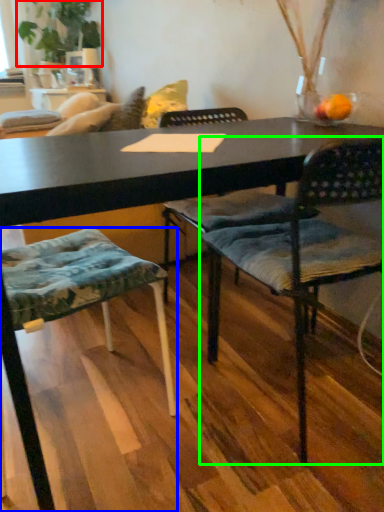
Question: Estimate the real-world distances between objects in this image. Which object is closer to plant (highlighted by a red box), chair (highlighted by a blue box) or chair (highlighted by a green box)?

Choices:
 (A) chair
 (B) chair

Answer: (A)